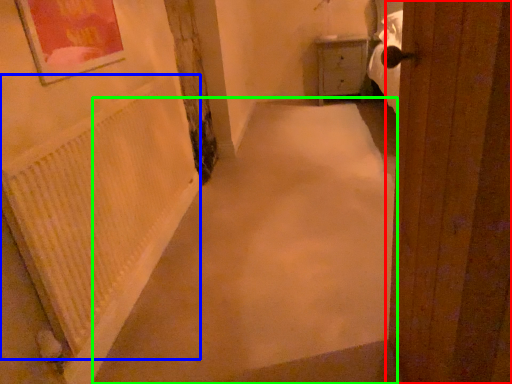
Question: Considering the real-world distances, which object is closest to door (highlighted by a red box)? radiator (highlighted by a blue box) or alley (highlighted by a green box).

Choices:
 (A) radiator
 (B) alley

Answer: (B)